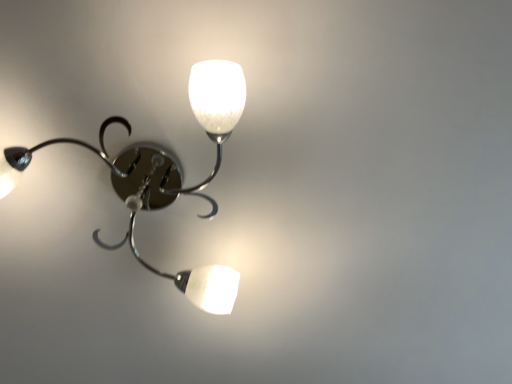
Find the location of a particular element. This screenshot has width=512, height=384. matte glass lamp at upper left is located at coordinates (165, 175).

Describe the element at coordinates (165, 175) in the screenshot. I see `matte glass lamp at upper left` at that location.

You are a GUI agent. You are given a task and a screenshot of the screen. Output one action in this format:
    pyautogui.click(x=<x>, y=<y>)
    Task: Click on the matte glass lamp at upper left
    Image resolution: width=512 pixels, height=384 pixels.
    Given the screenshot: What is the action you would take?
    pyautogui.click(x=165, y=175)